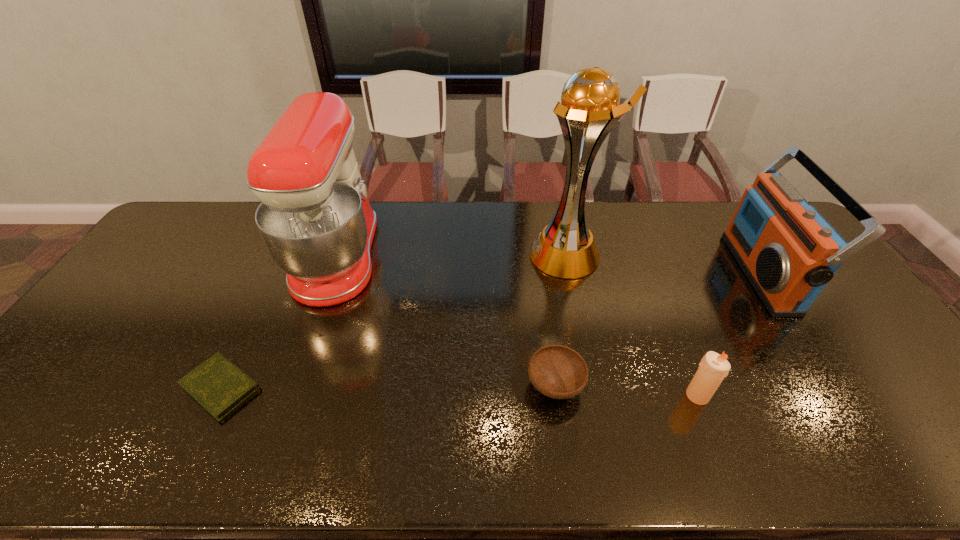
This screenshot has height=540, width=960. Find the location of `free location located 0.390m on the front-facing side of the tallest object`. free location located 0.390m on the front-facing side of the tallest object is located at coordinates (411, 255).

Find the location of a particular element. free space located 0.350m on the front-facing side of the mixer is located at coordinates (488, 257).

You are a GUI agent. You are given a task and a screenshot of the screen. Output one action in this format:
    pyautogui.click(x=<x>, y=<y>)
    Task: Click on the blank space located 0.090m on the front-facing side of the rightmost object
    This screenshot has height=540, width=960.
    Given the screenshot: What is the action you would take?
    pyautogui.click(x=711, y=273)

Locate an element on the screen. vacant area situated on the front-facing side of the rightmost object is located at coordinates (632, 273).

This screenshot has height=540, width=960. In order to click on vacant space located on the front-facing side of the rightmost object in this screenshot , I will do `click(622, 273)`.

The image size is (960, 540). Identify the location of free space located 0.310m on the left of the candle. pos(559,395).

What are the coordinates of `blank space located on the front of the fifth tallest object` in the screenshot? It's located at (564, 444).

At what (x,y) coordinates should I click in order to perform the action: click on free space located on the back of the diary. Please return your answer as a coordinate pair (x, y). The image size is (960, 540). Looking at the image, I should click on (264, 298).

I want to click on trophy that is at the far edge, so click(x=589, y=109).

The height and width of the screenshot is (540, 960). Identify the location of mixer present at the far edge. (315, 219).